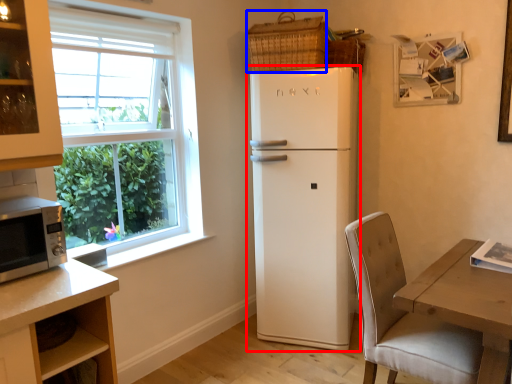
Question: Which object appears farthest to the camera in this image, refrigerator (highlighted by a red box) or basket (highlighted by a blue box)?

Choices:
 (A) refrigerator
 (B) basket

Answer: (B)